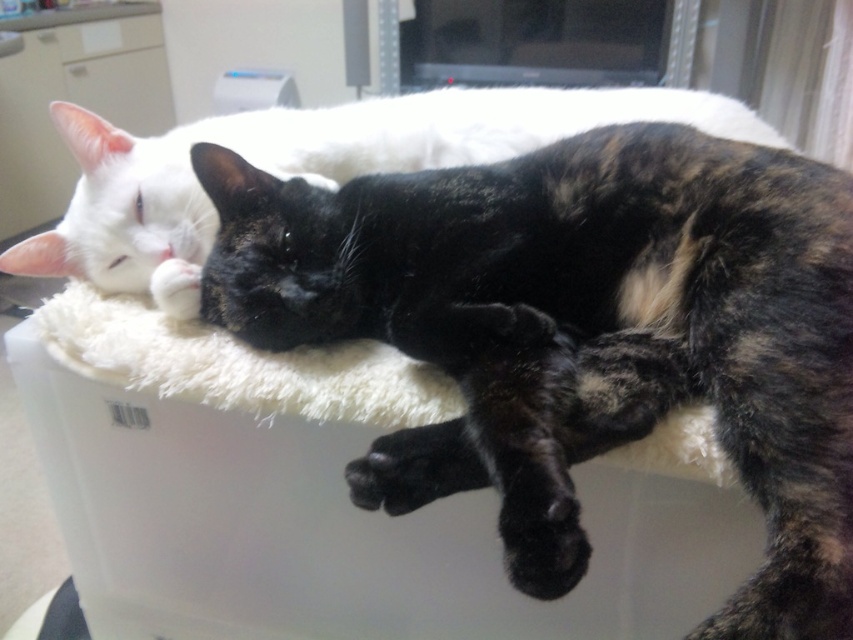
Does tortoiseshell fur cat at center appear under white fluffy cat bed at center?

No, tortoiseshell fur cat at center is not below white fluffy cat bed at center.

Between tortoiseshell fur cat at center and white fluffy cat bed at center, which one has less height?

white fluffy cat bed at center is shorter.

Is point (770, 250) less distant than point (403, 385)?

Yes, it is in front of point (403, 385).

The height and width of the screenshot is (640, 853). Identify the location of tortoiseshell fur cat at center. (581, 332).

Who is shorter, tortoiseshell fur cat at center or white fluffy cat at upper center?

With less height is white fluffy cat at upper center.

Is point (682, 387) positioned after point (537, 136)?

No, it is in front of (537, 136).

Is point (724, 605) closer to camera compared to point (364, 150)?

Yes.

The height and width of the screenshot is (640, 853). I want to click on tortoiseshell fur cat at center, so click(x=581, y=332).

Does point (236, 138) come closer to viewer compared to point (277, 404)?

No, it is not.

Can you confirm if white fluffy cat at upper center is positioned below white fluffy cat bed at center?

No, white fluffy cat at upper center is not below white fluffy cat bed at center.

Does point (221, 140) come behind point (213, 358)?

That is True.

I want to click on white fluffy cat at upper center, so click(306, 166).